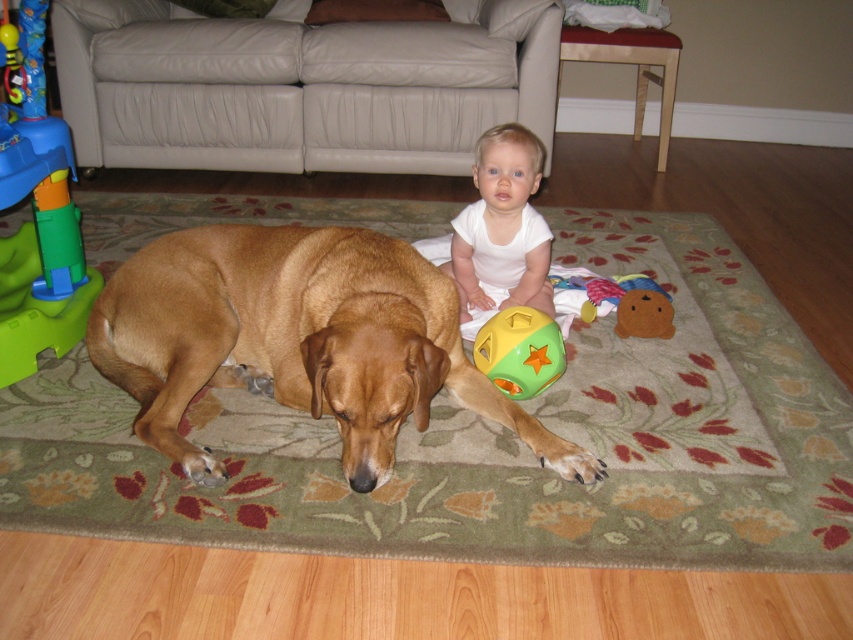
Does point (701, 326) come in front of point (537, 323)?

No, it is not.

Is floral rug at center behind green rubber ball at center?

No, it is in front of green rubber ball at center.

Is point (469, 476) in front of point (535, 381)?

Yes, point (469, 476) is closer to viewer.

Locate an element on the screen. The height and width of the screenshot is (640, 853). floral rug at center is located at coordinates (497, 442).

Does brown furry dog at center appear on the right side of soft plush bear at center?

Incorrect, brown furry dog at center is not on the right side of soft plush bear at center.

Is point (430, 305) positioned behind point (631, 324)?

No.

Locate an element on the screen. The width and height of the screenshot is (853, 640). brown furry dog at center is located at coordinates (299, 340).

Is green plastic toy at left bigger than soft plush bear at center?

Yes, green plastic toy at left is bigger than soft plush bear at center.

Can you confirm if green plastic toy at left is positioned above soft plush bear at center?

Indeed, green plastic toy at left is positioned over soft plush bear at center.

Is point (24, 138) closer to camera compared to point (666, 298)?

Yes, point (24, 138) is in front of point (666, 298).

This screenshot has width=853, height=640. I want to click on green plastic toy at left, so click(36, 211).